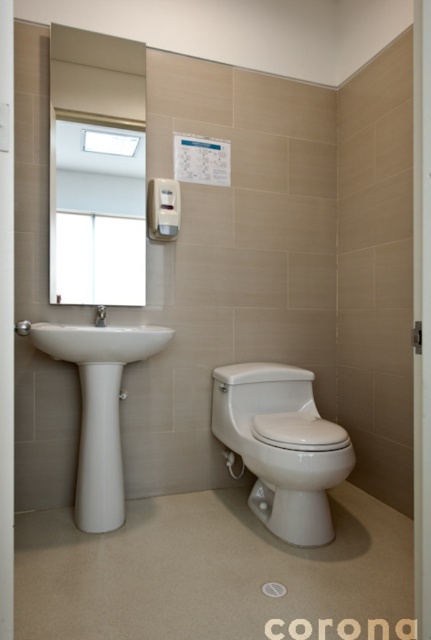
You are a contractor measuring bathroom fixtures. You have a 1.5 meter tall ladder that you need to place between the white glossy sink at left and the matte white shower at lower left. Will the ladder fit vertically between them?

The white glossy sink at left is taller than the matte white shower at lower left. Since the ladder is 1.5 meters tall, it may not fit vertically between them if the space between the two fixtures is constrained by their height difference. However, without knowing the exact vertical clearance, it is uncertain. The answer requires more information about the vertical distance between the sink and shower, not just their heights.

You are standing in the bathroom and want to wash your hands. You see the white glossy sink at left and the white glossy faucet at left. Which one should you turn on to start the water flow?

The white glossy faucet at left is the one you should turn on to start the water flow, as faucets control the water flow while sinks are the containers for water.